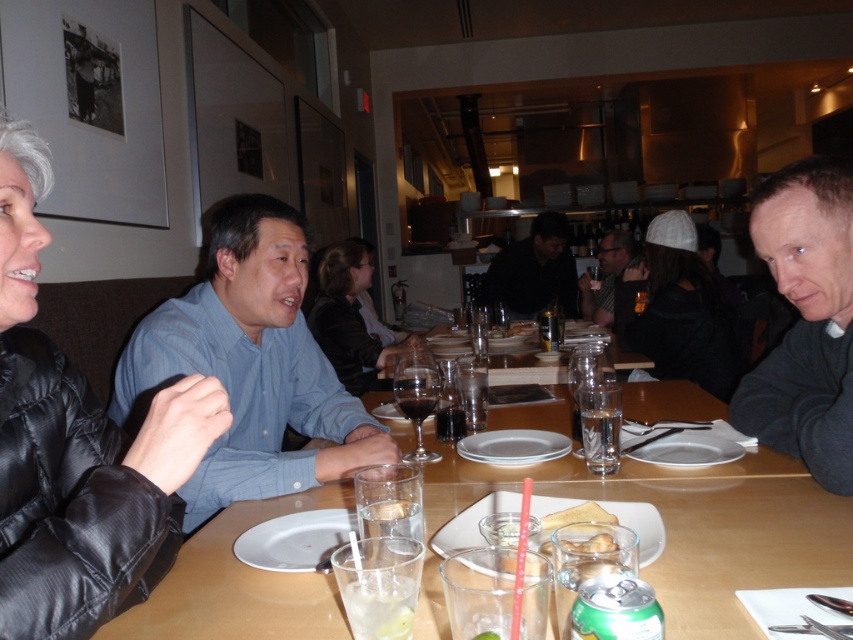
Question: Which object is the closest to the clear glass water at table center?

Choices:
 (A) black puffer jacket at left
 (B) blue shirt at center
 (C) dark blue shirt at center

Answer: (B)

Question: Which is farther from the black puffer jacket at left?

Choices:
 (A) black matte shirt at right
 (B) translucent glass wine at table center
 (C) clear glass at lower center

Answer: (A)

Question: Does clear glass at lower center have a lesser width compared to translucent glass wine at table center?

Choices:
 (A) yes
 (B) no

Answer: (B)

Question: Which of the following is the farthest from the observer?

Choices:
 (A) translucent glass wine at table center
 (B) black puffer jacket at left
 (C) clear glass water at table center
 (D) black matte shirt at right

Answer: (A)

Question: Does black puffer jacket at left lie behind white knit cap at upper center?

Choices:
 (A) no
 (B) yes

Answer: (A)

Question: Is black puffer jacket at left positioned behind dark red liquid at center?

Choices:
 (A) yes
 (B) no

Answer: (B)